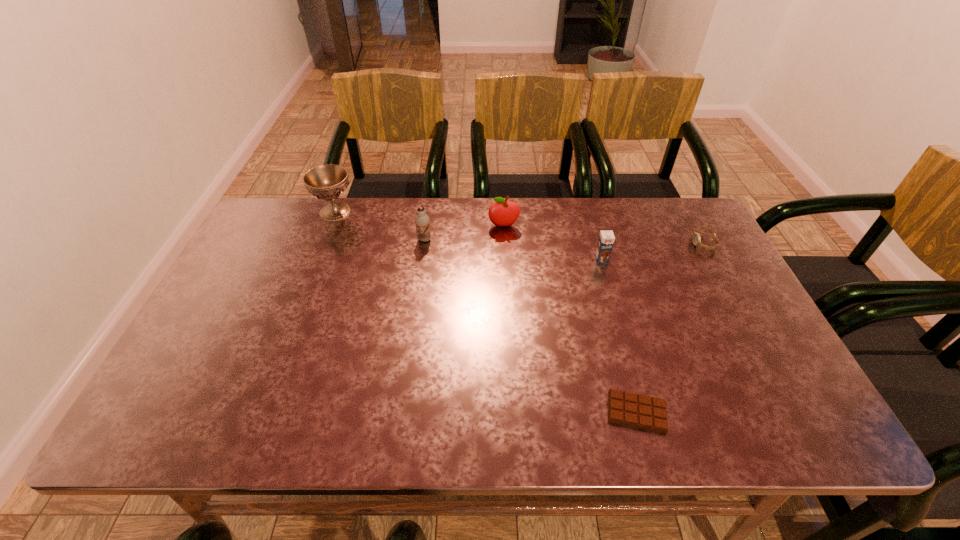
You are a GUI agent. You are given a task and a screenshot of the screen. Output one action in this format:
    pyautogui.click(x=<x>, y=<y>)
    Task: Click on the vacant region located on the front of the leftmost object
    Image resolution: width=960 pixels, height=540 pixels.
    Given the screenshot: What is the action you would take?
    pyautogui.click(x=308, y=284)

What are the coordinates of `free space located on the left of the taller chocolate milk` in the screenshot? It's located at (392, 239).

Identify the location of vacant space situated on the back of the apple. The image size is (960, 540). (502, 202).

I want to click on free region located 0.090m on the front label of the fifth farthest object, so click(609, 286).

Locate an element on the screen. vacant space situated on the face of the second shortest object is located at coordinates (646, 243).

At what (x,y) coordinates should I click in order to perform the action: click on free space located 0.210m on the face of the second shortest object. Please return your answer as a coordinate pair (x, y). Looking at the image, I should click on (623, 243).

Image resolution: width=960 pixels, height=540 pixels. In order to click on free space located 0.050m on the face of the second shortest object in this screenshot , I will do `click(676, 243)`.

Image resolution: width=960 pixels, height=540 pixels. What are the coordinates of `blank space located on the right of the shortest object` in the screenshot? It's located at (783, 412).

Identify the location of chalice at the far edge. This screenshot has height=540, width=960. (327, 182).

Where is `chocolate milk located in the far edge section of the desktop`? The width and height of the screenshot is (960, 540). chocolate milk located in the far edge section of the desktop is located at coordinates (422, 221).